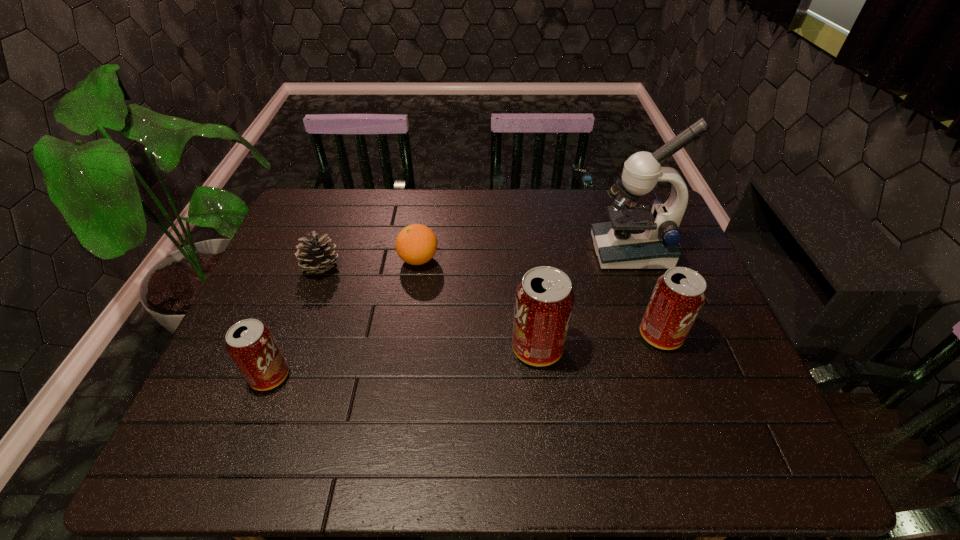
If the aim is uniform spacing by inserting an additional pop_(soda) among them, please point to a vacant space for this new pop_(soda). Please provide its 2D coordinates. Your answer should be formatted as a tuple, i.e. [(x, y)], where the tuple contains the x and y coordinates of a point satisfying the conditions above.

[(407, 362)]